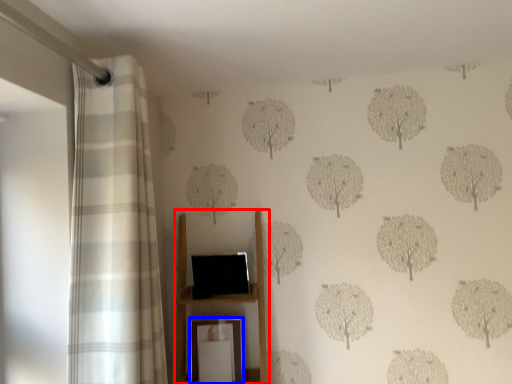
Question: Which of the following is the closest to the observer, furniture (highlighted by a red box) or picture frame (highlighted by a blue box)?

Choices:
 (A) furniture
 (B) picture frame

Answer: (A)